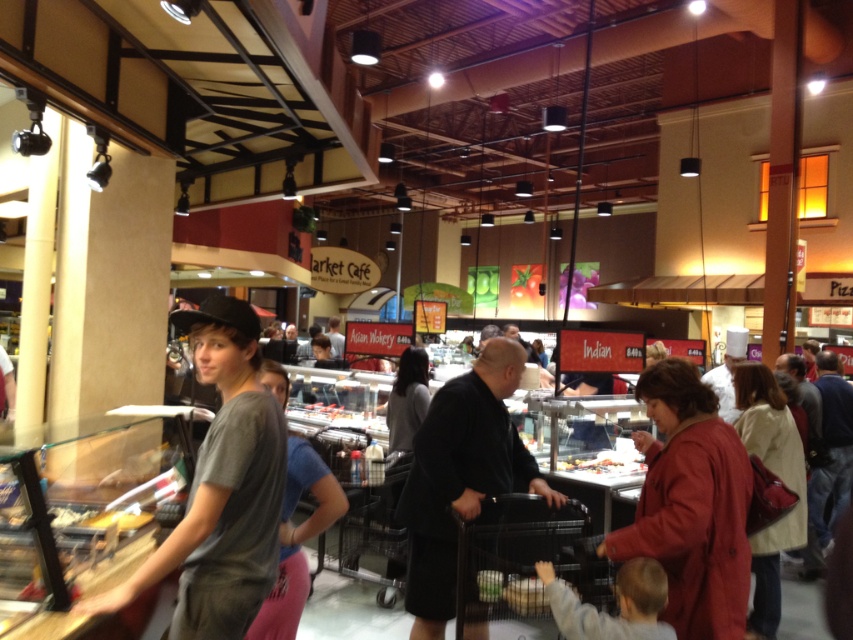
Can you confirm if gray cotton t-shirt at center is positioned below gray cotton shirt at center?

No, gray cotton t-shirt at center is not below gray cotton shirt at center.

Is gray cotton t-shirt at center further to the viewer compared to gray cotton shirt at center?

No.

Between point (244, 301) and point (339, 486), which one is positioned behind?

The point (339, 486) is more distant.

The image size is (853, 640). I want to click on gray cotton t-shirt at center, so click(x=221, y=488).

Can you confirm if matte red coat at lower right is smaller than light beige sweater at lower right?

Yes.

Between matte red coat at lower right and light beige sweater at lower right, which one has more height?

light beige sweater at lower right is taller.

Between point (691, 369) and point (759, 625), which one is positioned behind?

Point (759, 625)

Where is `matte red coat at lower right`? The width and height of the screenshot is (853, 640). matte red coat at lower right is located at coordinates [x=689, y=504].

Does point (276, 516) lie behind point (656, 378)?

No.

Does gray cotton t-shirt at center appear on the right side of matte red coat at lower right?

Incorrect, gray cotton t-shirt at center is not on the right side of matte red coat at lower right.

Find the location of a particular element. The height and width of the screenshot is (640, 853). gray cotton t-shirt at center is located at coordinates (221, 488).